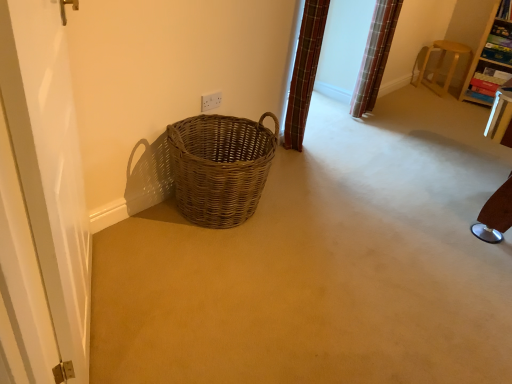
What are the coordinates of `white glossy screen door at left` in the screenshot? It's located at (49, 165).

Locate an element on the screen. wooden bookshelf at upper right, which is the second furniture in left-to-right order is located at coordinates (490, 55).

This screenshot has width=512, height=384. What do you see at coordinates (505, 10) in the screenshot?
I see `wooden bookshelf at upper right` at bounding box center [505, 10].

Identify the location of light brown wooden stool at upper right, which is counted as the 2th furniture, starting from the right. (442, 64).

Considering the relative sizes of plaid fabric curtain at upper right, the second curtain viewed from the back, and woven brown basket at center in the image provided, is plaid fabric curtain at upper right, the second curtain viewed from the back, smaller than woven brown basket at center?

Yes.

Does point (298, 92) come farther from viewer compared to point (232, 208)?

Yes.

Which object is closer to the camera taking this photo, plaid fabric curtain at upper right, the second curtain viewed from the back, or woven brown basket at center?

Positioned in front is woven brown basket at center.

From a real-world perspective, is plaid fabric curtain at upper right, which is the first curtain from left to right, located higher than woven brown basket at center?

Yes.

Is wooden bookshelf at upper right looking in the opposite direction of light brown wooden stool at upper right, which is counted as the 2th furniture, starting from the right?

wooden bookshelf at upper right does not have its back to light brown wooden stool at upper right, which is counted as the 2th furniture, starting from the right.

From a real-world perspective, is wooden bookshelf at upper right located beneath light brown wooden stool at upper right, which is the 1th furniture in left-to-right order?

No.

Which point is more forward, [501,13] or [422,63]?

The point [501,13] is closer.

From the image's perspective, which is below, wooden bookshelf at upper right or light brown wooden stool at upper right, which is counted as the 2th furniture, starting from the right?

light brown wooden stool at upper right, which is counted as the 2th furniture, starting from the right, appears lower in the image.

Can wooden bookshelf at upper right, acting as the 1th furniture starting from the right, be found inside plaid fabric curtain at upper right, which is the second curtain from left to right?

Actually, wooden bookshelf at upper right, acting as the 1th furniture starting from the right, is outside plaid fabric curtain at upper right, which is the second curtain from left to right.

The height and width of the screenshot is (384, 512). In order to click on the 1st curtain in front of the wooden bookshelf at upper right, acting as the 1th furniture starting from the right in this screenshot , I will do `click(375, 56)`.

Is the position of plaid fabric curtain at upper right, which is the second curtain from left to right, less distant than that of wooden bookshelf at upper right, acting as the 1th furniture starting from the right?

Yes, it is.

Would you say plaid fabric curtain at upper right, placed as the 1th curtain when sorted from right to left, is a long distance from wooden bookshelf at upper right, acting as the 1th furniture starting from the right?

That's right, there is a large distance between plaid fabric curtain at upper right, placed as the 1th curtain when sorted from right to left, and wooden bookshelf at upper right, acting as the 1th furniture starting from the right.

From a real-world perspective, which object stands above the other?

wooden bookshelf at upper right, from a real-world perspective.

Is plaid fabric curtain at upper right, placed as the 1th curtain when sorted from right to left, turned away from wooden bookshelf at upper right?

No, plaid fabric curtain at upper right, placed as the 1th curtain when sorted from right to left, is not facing away from wooden bookshelf at upper right.

Based on the photo, from the image's perspective, which object appears higher, plaid fabric curtain at upper right, the second curtain in the front-to-back sequence, or wooden bookshelf at upper right?

wooden bookshelf at upper right, from the image's perspective.

Is plaid fabric curtain at upper right, which ranks as the first curtain in back-to-front order, outside of wooden bookshelf at upper right?

Yes.

Looking at this image, which is nearer, (490, 50) or (177, 124)?

Point (490, 50) appears to be farther away from the viewer than point (177, 124).

Can you confirm if wooden bookshelf at upper right, acting as the 1th furniture starting from the right, is taller than woven brown basket at center?

Yes.

Considering the sizes of objects wooden bookshelf at upper right, acting as the 1th furniture starting from the right, and woven brown basket at center in the image provided, who is wider, wooden bookshelf at upper right, acting as the 1th furniture starting from the right, or woven brown basket at center?

Wider between the two is woven brown basket at center.

From a real-world perspective, who is located higher, wooden bookshelf at upper right, acting as the 1th furniture starting from the right, or woven brown basket at center?

In real-world perspective, wooden bookshelf at upper right, acting as the 1th furniture starting from the right, is above.

Which point is more distant from viewer, (x=449, y=83) or (x=378, y=19)?

Point (x=449, y=83)

Does light brown wooden stool at upper right, which is counted as the 2th furniture, starting from the right, lie behind plaid fabric curtain at upper right, the second curtain in the front-to-back sequence?

Yes, it is behind plaid fabric curtain at upper right, the second curtain in the front-to-back sequence.

Is light brown wooden stool at upper right, which is the 1th furniture in left-to-right order, aimed at plaid fabric curtain at upper right, which ranks as the first curtain in back-to-front order?

Yes, light brown wooden stool at upper right, which is the 1th furniture in left-to-right order, is aimed at plaid fabric curtain at upper right, which ranks as the first curtain in back-to-front order.

Is light brown wooden stool at upper right, which is counted as the 2th furniture, starting from the right, bigger than plaid fabric curtain at upper right, placed as the 1th curtain when sorted from right to left?

Actually, light brown wooden stool at upper right, which is counted as the 2th furniture, starting from the right, might be smaller than plaid fabric curtain at upper right, placed as the 1th curtain when sorted from right to left.

Consider the image. From a real-world perspective, is plaid fabric curtain at upper right, which ranks as the first curtain in back-to-front order, below plaid fabric curtain at upper right, which is the first curtain from left to right?

Yes, from a real-world perspective, plaid fabric curtain at upper right, which ranks as the first curtain in back-to-front order, is under plaid fabric curtain at upper right, which is the first curtain from left to right.

Would you say plaid fabric curtain at upper right, which ranks as the first curtain in back-to-front order, is inside or outside plaid fabric curtain at upper right, which is counted as the 1th curtain, starting from the front?

plaid fabric curtain at upper right, which ranks as the first curtain in back-to-front order, is not enclosed by plaid fabric curtain at upper right, which is counted as the 1th curtain, starting from the front.

Which object is further away from the camera, plaid fabric curtain at upper right, placed as the 1th curtain when sorted from right to left, or plaid fabric curtain at upper right, which is counted as the 1th curtain, starting from the front?

plaid fabric curtain at upper right, placed as the 1th curtain when sorted from right to left.

Where is `basket directly beneath the plaid fabric curtain at upper right, which is counted as the 1th curtain, starting from the front (from a real-world perspective)`? Image resolution: width=512 pixels, height=384 pixels. basket directly beneath the plaid fabric curtain at upper right, which is counted as the 1th curtain, starting from the front (from a real-world perspective) is located at coordinates (x=220, y=167).

Where is `shelf on the right of light brown wooden stool at upper right, which is the 1th furniture in left-to-right order`? shelf on the right of light brown wooden stool at upper right, which is the 1th furniture in left-to-right order is located at coordinates (505, 10).

Considering their positions, is plaid fabric curtain at upper right, the second curtain in the front-to-back sequence, positioned further to plaid fabric curtain at upper right, the second curtain viewed from the back, than white glossy screen door at left?

white glossy screen door at left is positioned further to the anchor plaid fabric curtain at upper right, the second curtain viewed from the back.

Looking at the image, which one is located further to white glossy screen door at left, woven brown basket at center or wooden bookshelf at upper right?

Based on the image, wooden bookshelf at upper right appears to be further to white glossy screen door at left.

Estimate the real-world distances between objects in this image. Which object is closer to light brown wooden stool at upper right, which is the 1th furniture in left-to-right order, wooden bookshelf at upper right, which is the second furniture in left-to-right order, or plaid fabric curtain at upper right, placed as the 1th curtain when sorted from right to left?

Among the two, wooden bookshelf at upper right, which is the second furniture in left-to-right order, is located nearer to light brown wooden stool at upper right, which is the 1th furniture in left-to-right order.

Based on their spatial positions, is wooden bookshelf at upper right, acting as the 1th furniture starting from the right, or woven brown basket at center closer to light brown wooden stool at upper right, which is counted as the 2th furniture, starting from the right?

Among the two, wooden bookshelf at upper right, acting as the 1th furniture starting from the right, is located nearer to light brown wooden stool at upper right, which is counted as the 2th furniture, starting from the right.

When comparing their distances from white glossy screen door at left, does light brown wooden stool at upper right, which is the 1th furniture in left-to-right order, or woven brown basket at center seem closer?

The object closer to white glossy screen door at left is woven brown basket at center.

Based on their spatial positions, is plaid fabric curtain at upper right, which is the second curtain from left to right, or light brown wooden stool at upper right, which is counted as the 2th furniture, starting from the right, further from wooden bookshelf at upper right, acting as the 1th furniture starting from the right?

plaid fabric curtain at upper right, which is the second curtain from left to right, is positioned further to the anchor wooden bookshelf at upper right, acting as the 1th furniture starting from the right.

Which object lies further to the anchor point plaid fabric curtain at upper right, which is counted as the 1th curtain, starting from the front, woven brown basket at center or wooden bookshelf at upper right, which is the second furniture in left-to-right order?

wooden bookshelf at upper right, which is the second furniture in left-to-right order.

Considering their positions, is woven brown basket at center positioned closer to plaid fabric curtain at upper right, which ranks as the first curtain in back-to-front order, than white glossy screen door at left?

woven brown basket at center is closer to plaid fabric curtain at upper right, which ranks as the first curtain in back-to-front order.

You are a GUI agent. You are given a task and a screenshot of the screen. Output one action in this format:
    pyautogui.click(x=<x>, y=<y>)
    Task: Click on the curtain between plaid fabric curtain at upper right, the second curtain viewed from the back, and wooden bookshelf at upper right, which is the second furniture in left-to-right order, in the horizontal direction
    
    Given the screenshot: What is the action you would take?
    pyautogui.click(x=375, y=56)

The height and width of the screenshot is (384, 512). Identify the location of furniture between plaid fabric curtain at upper right, the second curtain in the front-to-back sequence, and wooden bookshelf at upper right, in the horizontal direction. (442, 64).

The height and width of the screenshot is (384, 512). Find the location of `furniture between plaid fabric curtain at upper right, which is the first curtain from left to right, and wooden bookshelf at upper right`. furniture between plaid fabric curtain at upper right, which is the first curtain from left to right, and wooden bookshelf at upper right is located at coordinates (442, 64).

Find the location of a particular element. The width and height of the screenshot is (512, 384). basket between white glossy screen door at left and wooden bookshelf at upper right is located at coordinates (220, 167).